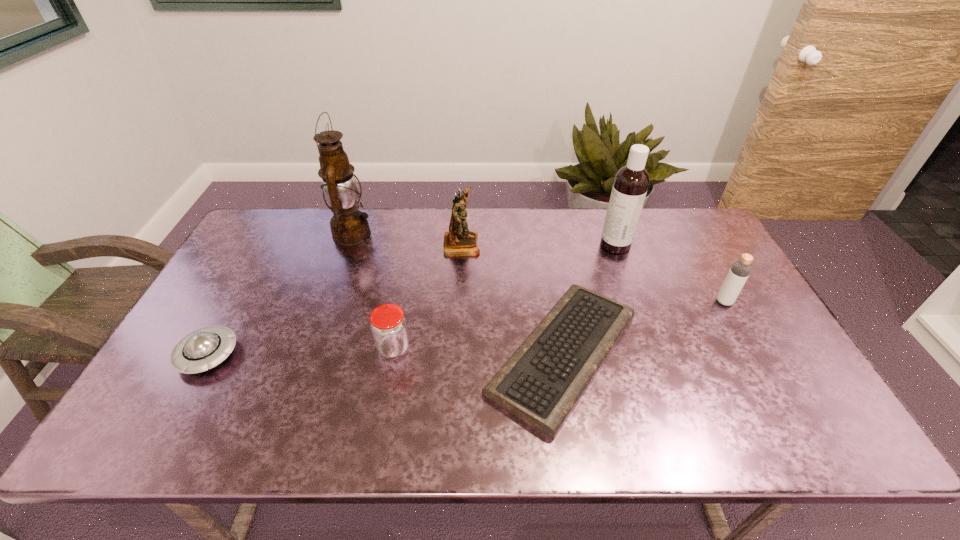
At what (x,y) coordinates should I click in order to perform the action: click on saucer. Please return your answer as a coordinate pair (x, y). This screenshot has height=540, width=960. Looking at the image, I should click on (204, 348).

Find the location of a particular element. the shortest object is located at coordinates pos(541,383).

At what (x,y) coordinates should I click in order to perform the action: click on vacant space located on the left of the second object from left to right. Please return your answer as a coordinate pair (x, y). Looking at the image, I should click on (309, 234).

You are a GUI agent. You are given a task and a screenshot of the screen. Output one action in this format:
    pyautogui.click(x=<x>, y=<y>)
    Task: Click on the vacant space located 0.310m on the label side of the second tallest object
    The height and width of the screenshot is (540, 960).
    Given the screenshot: What is the action you would take?
    507,245

This screenshot has width=960, height=540. Identify the location of free space located on the label side of the second tallest object. (531, 245).

The width and height of the screenshot is (960, 540). I want to click on vacant space situated 0.200m on the label side of the second tallest object, so click(540, 245).

Locate an element on the screen. The height and width of the screenshot is (540, 960). vacant space located 0.120m on the front-facing side of the fourth object from left to right is located at coordinates click(516, 244).

Where is `blank space located on the front of the fourth shortest object`? blank space located on the front of the fourth shortest object is located at coordinates (766, 376).

Where is `vacant space located 0.200m on the left of the fifth tallest object`? vacant space located 0.200m on the left of the fifth tallest object is located at coordinates (300, 348).

Locate an element on the screen. The height and width of the screenshot is (540, 960). blank area located 0.190m on the right of the leftmost object is located at coordinates [311, 355].